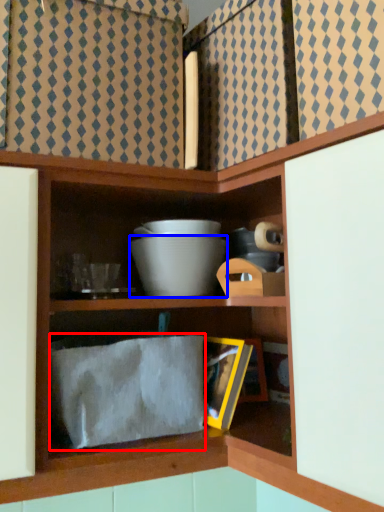
Question: Among these objects, which one is nearest to the camera, cloth (highlighted by a red box) or bowl (highlighted by a blue box)?

Choices:
 (A) cloth
 (B) bowl

Answer: (A)